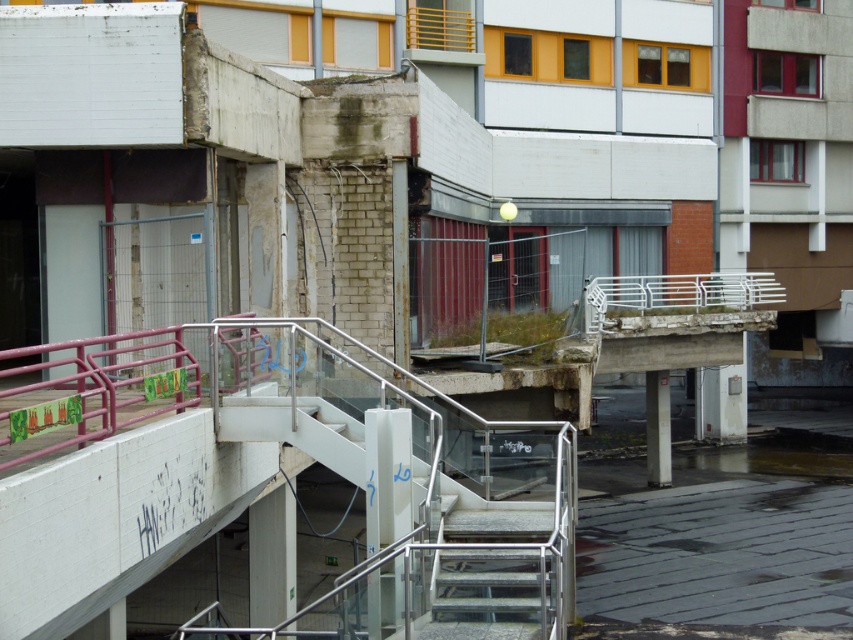
You are standing at the top of the staircase in the image. You see a point at coordinates (328, 467). What object is this point located on?

The point at coordinates (328, 467) is located on the metallic pink railing at center.

You are an inspector assessing the safety of the metallic pink railing at center and the metallic gray stairs at center. Which object is closer to you when you are standing at the base of the stairs?

The metallic pink railing at center is closer to you than the metallic gray stairs at center because it is positioned further to the viewer.